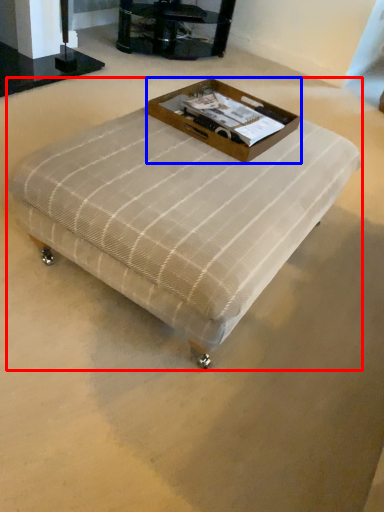
Question: Which object is further to the camera taking this photo, table (highlighted by a red box) or box (highlighted by a blue box)?

Choices:
 (A) table
 (B) box

Answer: (B)